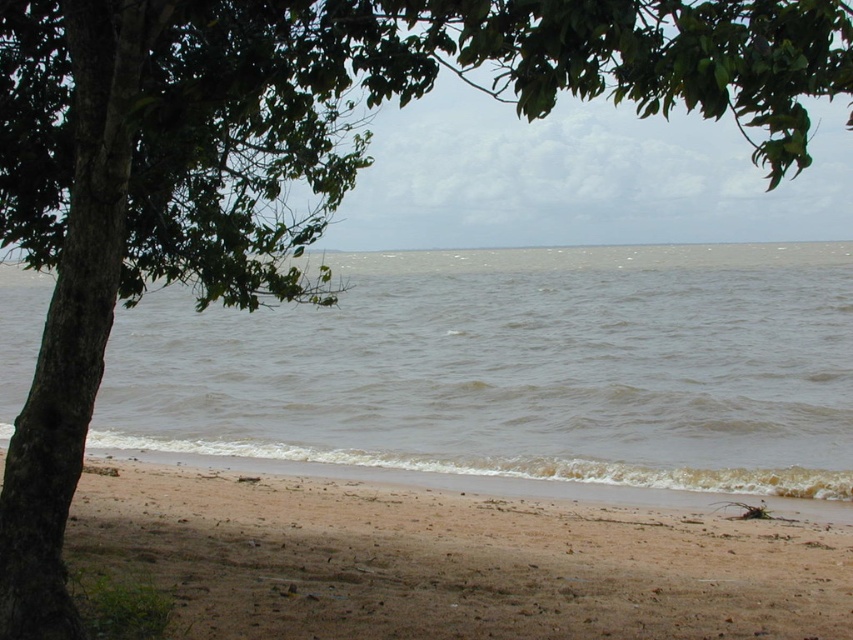
You are standing at the beach and want to walk from point A to point B. Point A is located at coordinate point (776, 288) and point B is at coordinate point (442, 508). Which point is closer to you when you start walking?

Point B at (442, 508) is closer to you because it is less far from the camera than point A at (776, 288).

You are standing on the brown sandy beach at lower center and want to reach the water. Which direction should you walk to get to the brown water at lower center?

You should walk to the right because the brown water at lower center is located to the right of the brown sandy beach at lower center.

You are standing on the brown sandy beach at lower center and want to reach the tree trunk on the left. Which direction should you walk to avoid stepping into the brown water at lower center?

You should walk towards the tree trunk on the left while staying on the brown sandy beach at lower center, which is behind the brown water at lower center. Since the brown water at lower center is closer to you, moving towards the tree trunk while staying on the beach will keep you away from the water.